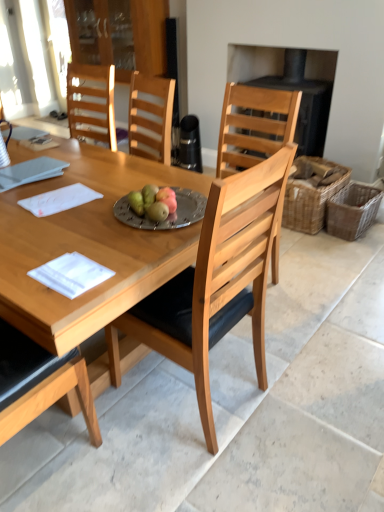
Find the location of a particular element. The height and width of the screenshot is (512, 384). free space to the left of white paper at center, the third notepad from the top is located at coordinates (19, 275).